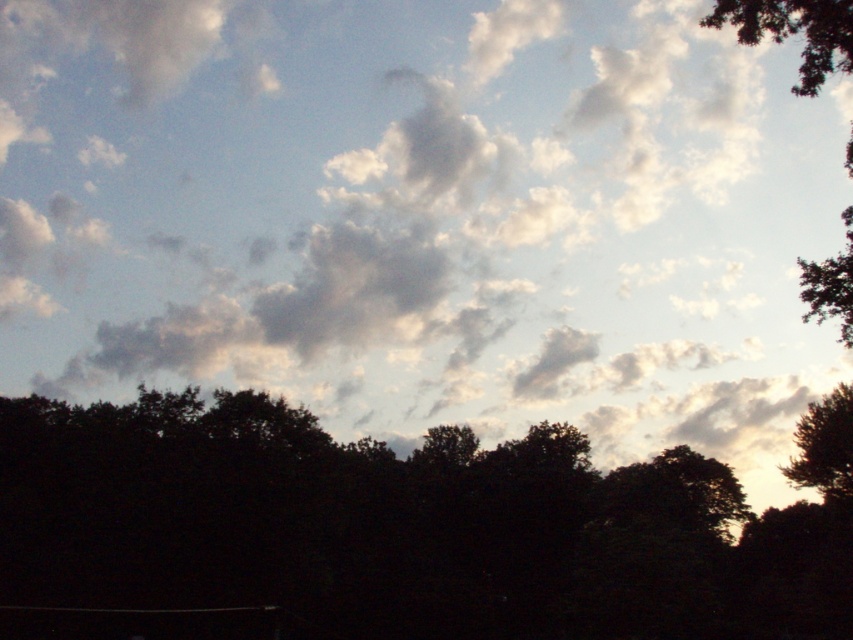
You are an astronomer analyzing the sky scene. You notice the white fluffy cloud at upper center. What are its coordinates in the image?

The white fluffy cloud at upper center is located at coordinates (421, 214).

You are an astronomer analyzing the image. The white fluffy cloud at upper center has coordinates in the image. What are its coordinates?

The white fluffy cloud at upper center is located at coordinates (421,214).